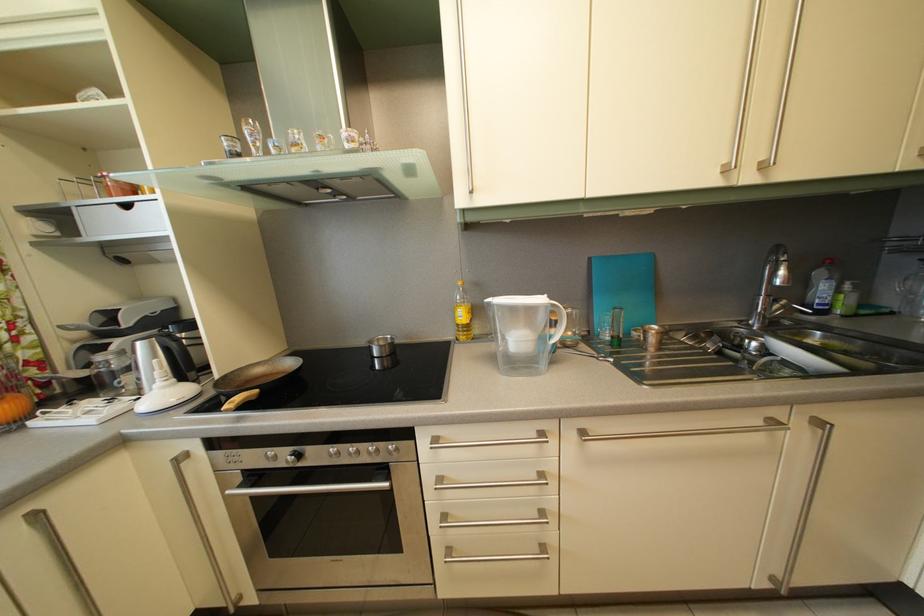
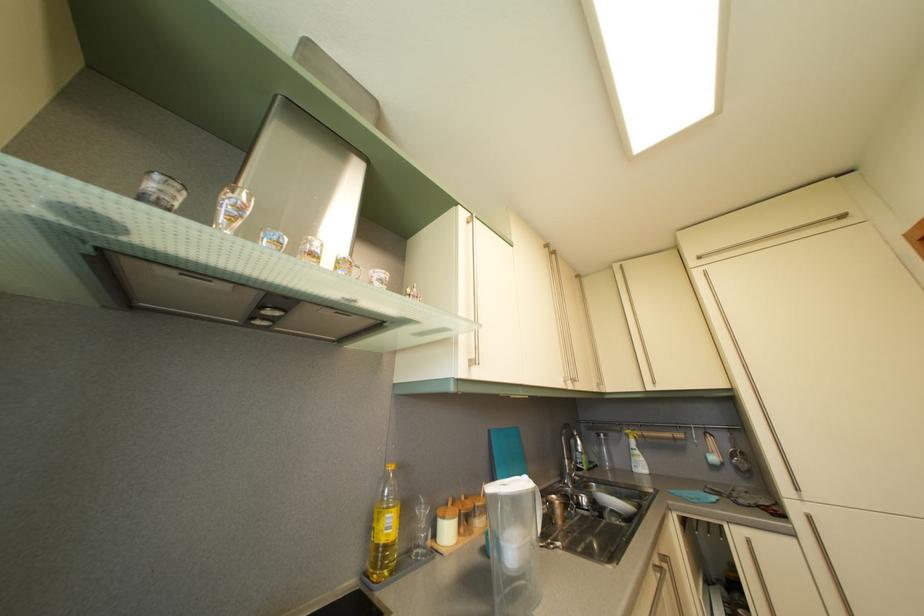
The point at [785,254] is marked in the first image. Where is the corresponding point in the second image?

(575, 432)